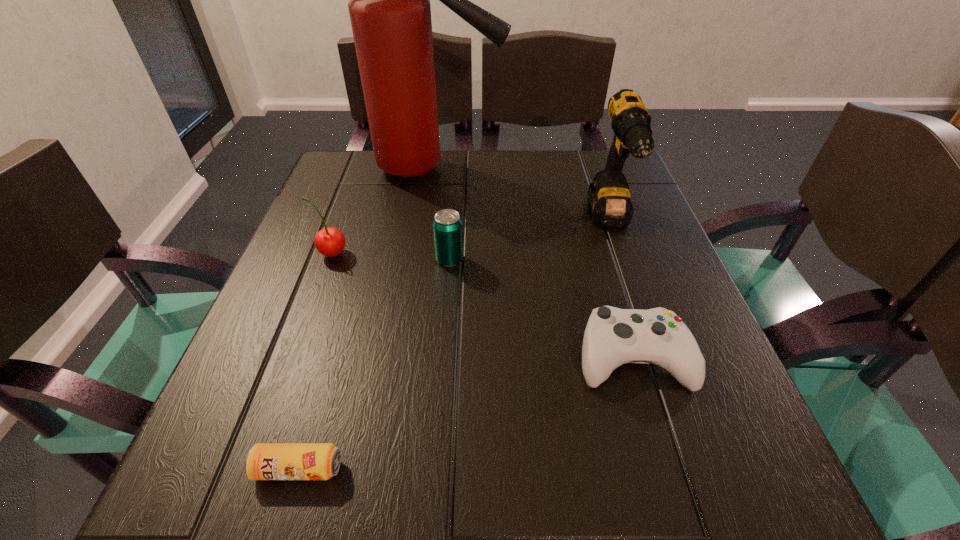
At what (x,y) coordinates should I click in order to perform the action: click on the tallest object. Please return your answer as a coordinate pair (x, y). The width and height of the screenshot is (960, 540). Looking at the image, I should click on (x=390, y=13).

This screenshot has height=540, width=960. Find the location of `fire extinguisher`. fire extinguisher is located at coordinates (390, 13).

The height and width of the screenshot is (540, 960). What are the coordinates of `the fifth shortest object` in the screenshot? It's located at (608, 197).

Identify the location of cherry. (330, 242).

The image size is (960, 540). I want to click on the right beer can, so click(447, 225).

At what (x,y) coordinates should I click in order to perform the action: click on the farther beer can. Please return your answer as a coordinate pair (x, y). Image resolution: width=960 pixels, height=540 pixels. Looking at the image, I should click on (447, 225).

Locate an element on the screen. the fifth tallest object is located at coordinates (613, 336).

The width and height of the screenshot is (960, 540). Find the location of `control`. control is located at coordinates (613, 336).

Locate an element on the screen. the shorter beer can is located at coordinates (264, 461).

The image size is (960, 540). I want to click on the nearer beer can, so click(264, 461).